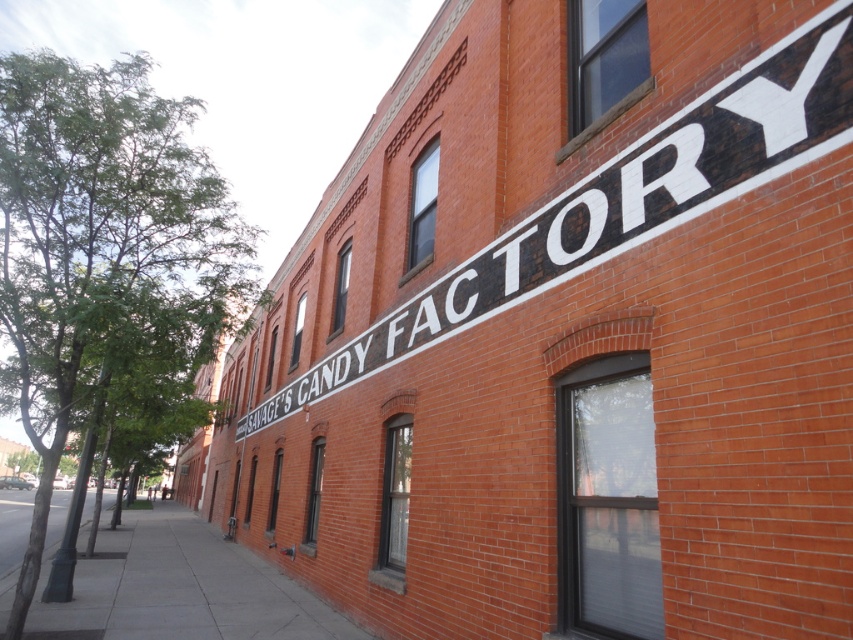
Question: Does black painted sign at upper center appear on the left side of gray concrete sidewalk at lower left?

Choices:
 (A) no
 (B) yes

Answer: (A)

Question: Is black painted sign at upper center to the left of gray concrete sidewalk at lower left from the viewer's perspective?

Choices:
 (A) no
 (B) yes

Answer: (A)

Question: Where is black painted sign at upper center located in relation to gray concrete sidewalk at lower left in the image?

Choices:
 (A) above
 (B) below

Answer: (A)

Question: Among these objects, which one is nearest to the camera?

Choices:
 (A) black painted sign at upper center
 (B) gray concrete sidewalk at lower left

Answer: (A)

Question: Which of the following is the closest to the observer?

Choices:
 (A) (96, 593)
 (B) (448, 336)

Answer: (B)